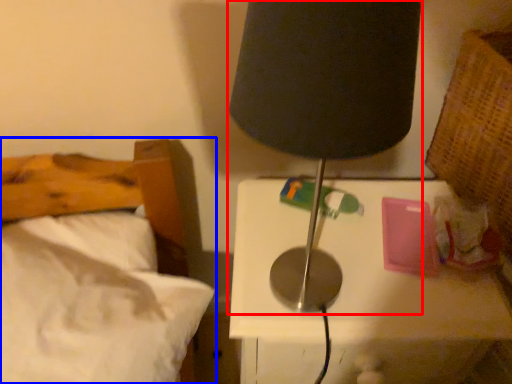
Question: Among these objects, which one is nearest to the camera, lamp (highlighted by a red box) or bed (highlighted by a blue box)?

Choices:
 (A) lamp
 (B) bed

Answer: (A)